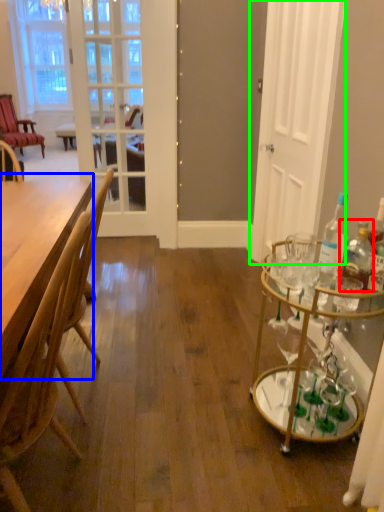
Question: Based on their relative distances, which object is farther from bottle (highlighted by a red box)? Choose from table (highlighted by a blue box) and door (highlighted by a green box).

Choices:
 (A) table
 (B) door

Answer: (B)